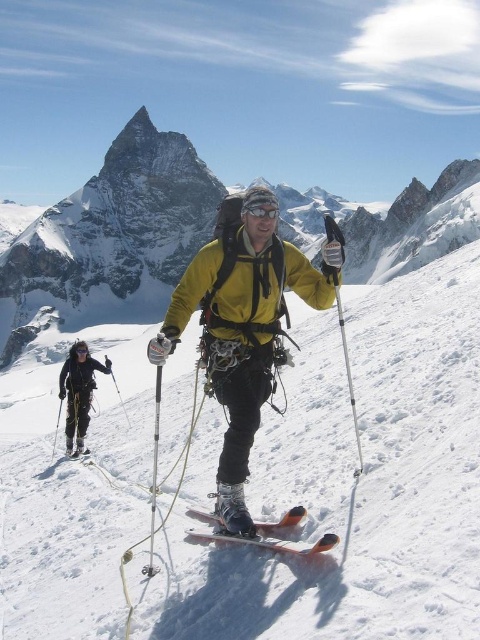
Question: Does black matte ski pants at lower left have a lesser width compared to black matte goggles at center?

Choices:
 (A) no
 (B) yes

Answer: (A)

Question: Is silver metallic ski pole at center wider than black matte goggles at upper center?

Choices:
 (A) yes
 (B) no

Answer: (A)

Question: Which object appears farthest from the camera in this image?

Choices:
 (A) white snow mountain at upper left
 (B) black matte goggles at center

Answer: (A)

Question: Which object is the farthest from the silver metallic ski pole at center?

Choices:
 (A) orange metallic ski at center
 (B) black matte goggles at upper center

Answer: (B)

Question: Which of the following is the farthest from the observer?

Choices:
 (A) white snow mountain at upper left
 (B) yellow matte jacket at center

Answer: (A)

Question: Does black matte ski pants at lower left lie behind silver metallic ski pole at center?

Choices:
 (A) yes
 (B) no

Answer: (A)